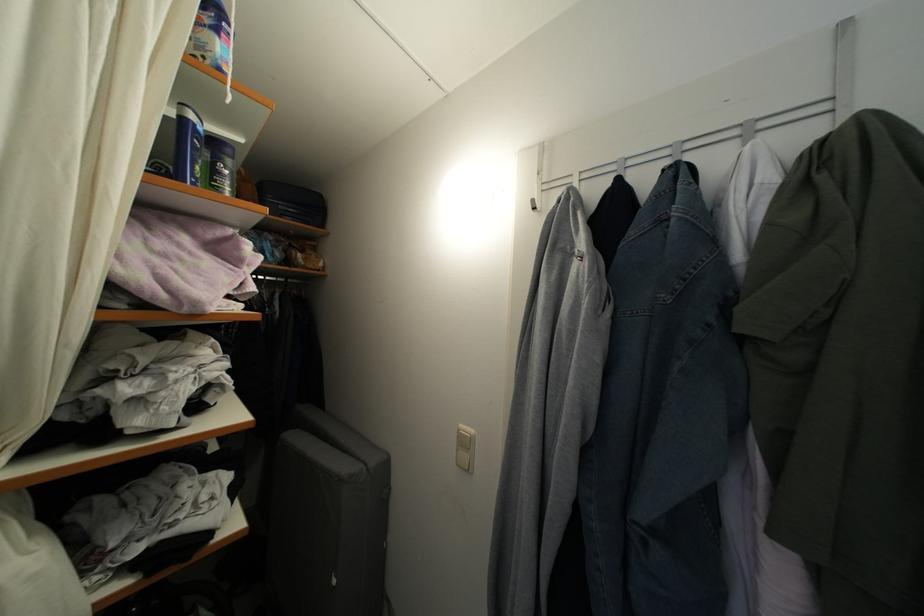
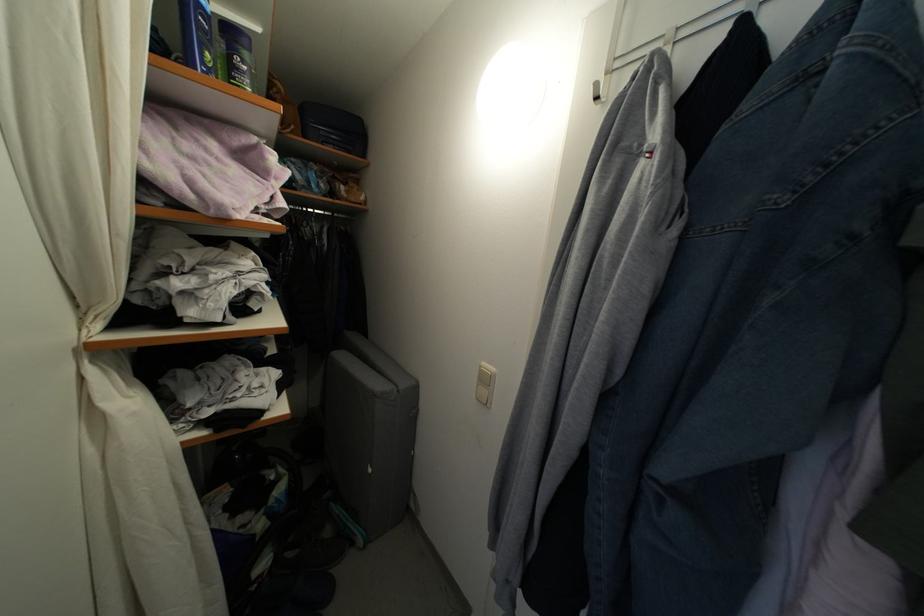
Locate, in the second image, the point that corresponds to the point at 199,182 in the first image.

(210, 70)